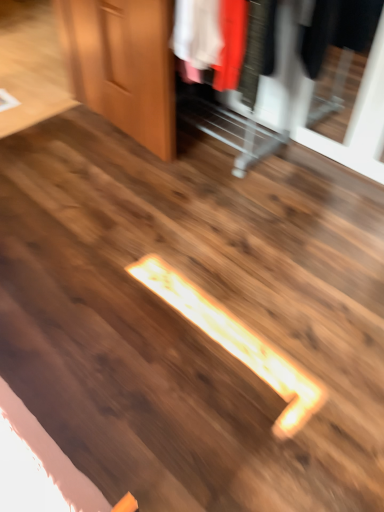
Find the location of a particular element. This screenshot has width=384, height=512. vacant area situated to the left side of wooden door at upper left is located at coordinates (59, 134).